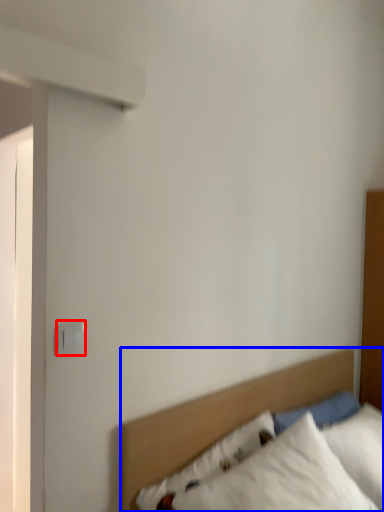
Question: Among these objects, which one is farthest to the camera, electric outlet (highlighted by a red box) or bed (highlighted by a blue box)?

Choices:
 (A) electric outlet
 (B) bed

Answer: (A)